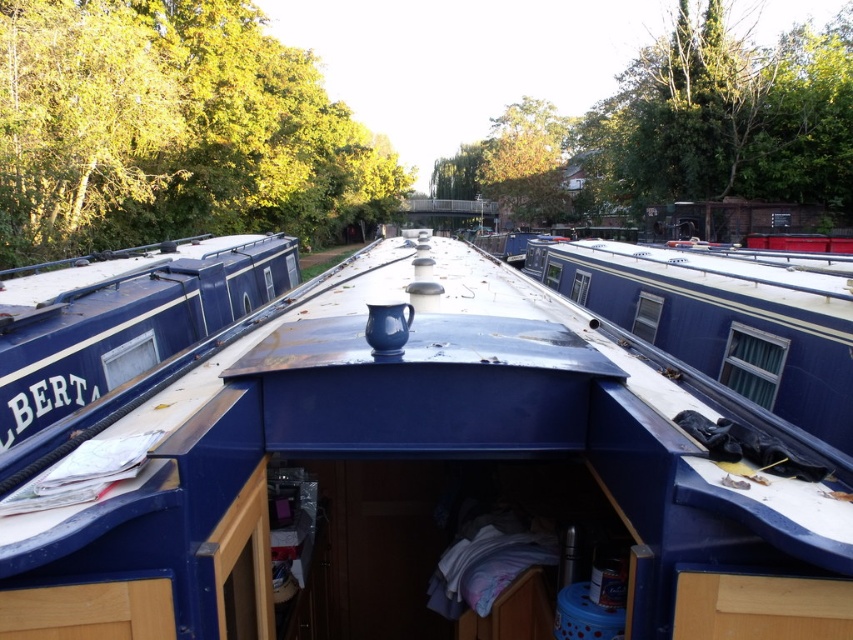
Describe the element at coordinates (425, 480) in the screenshot. I see `glossy ceramic mug at upper center` at that location.

Does point (332, 432) come in front of point (274, 260)?

Yes, it is in front of point (274, 260).

What are the coordinates of `glossy ceramic mug at upper center` in the screenshot? It's located at (425, 480).

Is point (163, 467) positioned before point (730, 372)?

Yes, it is.

Which is behind, point (671, 564) or point (749, 388)?

Point (749, 388)

Locate an element on the screen. The image size is (853, 640). glossy ceramic mug at upper center is located at coordinates (425, 480).

Who is lower down, blue painted cabin at right or blue painted wood barge at left?

blue painted wood barge at left

Where is `blue painted cabin at right`? This screenshot has height=640, width=853. blue painted cabin at right is located at coordinates (723, 321).